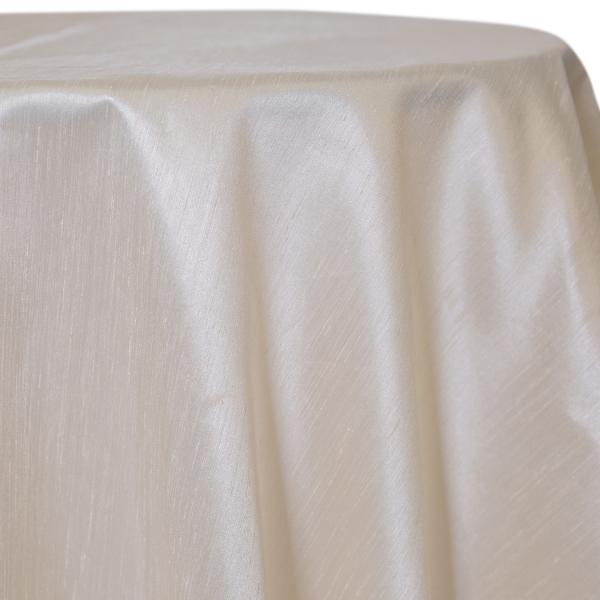
This screenshot has height=600, width=600. I want to click on satin cloth, so click(342, 487).